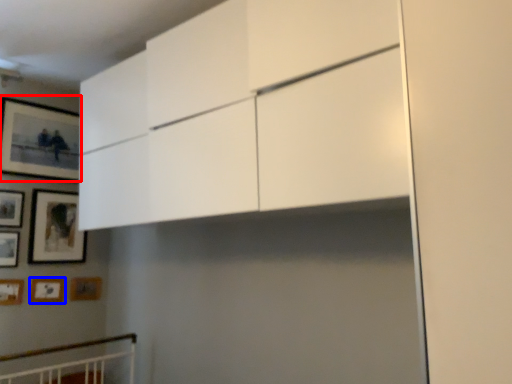
Question: Among these objects, which one is nearest to the camera, picture frame (highlighted by a red box) or picture frame (highlighted by a blue box)?

Choices:
 (A) picture frame
 (B) picture frame

Answer: (A)